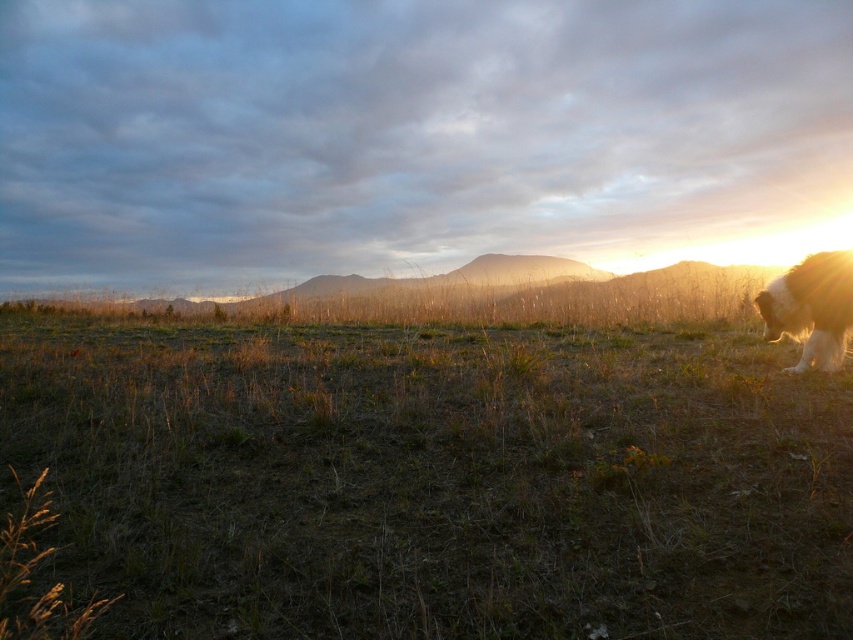
You are standing at the center of an open field with sparse dry grass. There is a specific point marked at coordinates (433, 477). What is located at that point?

The point at (433, 477) has brown dry grass at center.

You are a photographer standing in the field and want to capture a photo of the fuzzy white dog at right without the brown dry grass at center appearing in the foreground. How should you adjust your camera angle?

To avoid the brown dry grass at center in the foreground, you can aim your camera upward to focus on the fuzzy white dog at right since the brown dry grass at center is positioned below the dog.